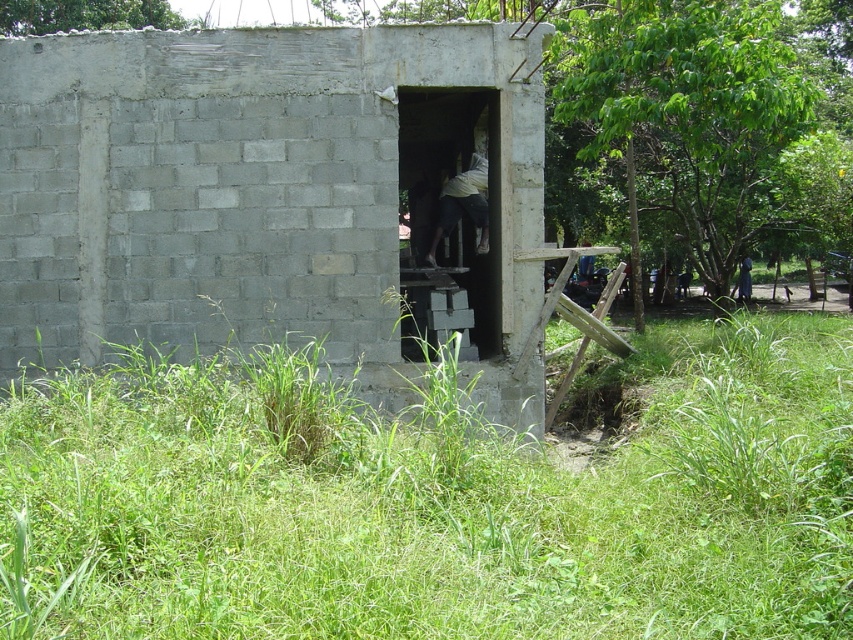
You are a construction worker who needs to lay a 2 meter long wooden plank between the green grass at lower center and the dark blue fabric at center. Which object should the plank be placed closer to to ensure it fits properly?

The green grass at lower center is wider than the dark blue fabric at center. Therefore, the plank should be placed closer to the dark blue fabric at center to accommodate its narrower width.

You are a construction worker who just arrived at the site. You see the green grass at lower center and the dark blue fabric at center. Which one is taller?

The dark blue fabric at center is taller than the green grass at lower center.

You are standing at the entrance of the partially constructed building and want to reach the point labeled point [341,602]. There is an obstacle at point [396,349]. Can you walk directly to your destination without going around the obstacle?

Yes, because point [341,602] is closer to the camera than point [396,349], meaning it is in front of the obstacle and you can walk directly to it without needing to go around.